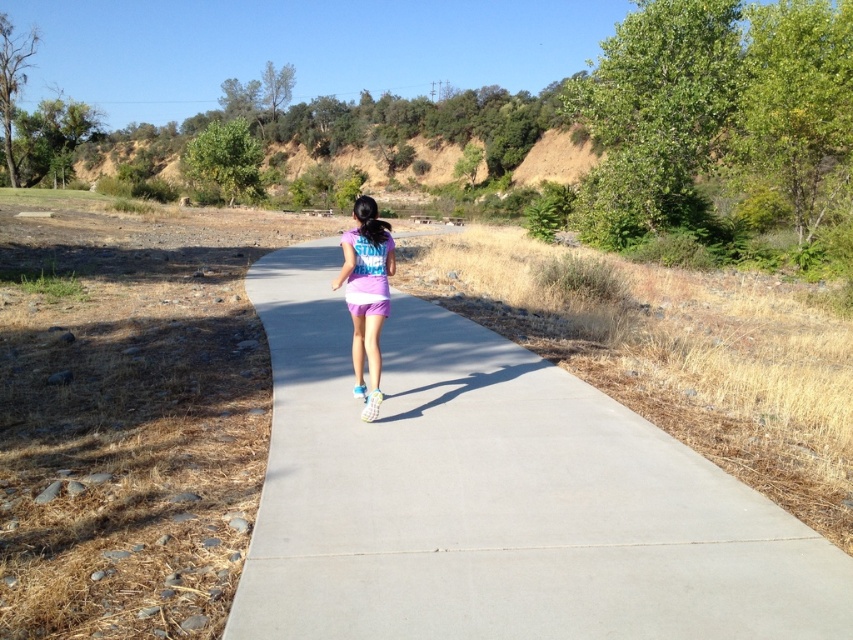
You are a photographer standing on the path and want to take a photo of the purple fabric shorts at center. Since the gray concrete pavement at center is below it, where should you position your camera relative to the path to capture the shorts in the shot?

Since the gray concrete pavement at center is below the purple fabric shorts at center, you should position your camera above the path to ensure the shorts are visible and not blocked by the pavement in the photo.

You are a photographer trying to capture the entire scene of the gray concrete pavement at center and the purple fabric shorts at center in one shot. Based on their sizes, which object should you focus on to ensure both are visible without zooming in or out?

The gray concrete pavement at center is larger in size than the purple fabric shorts at center, so focusing on the gray concrete pavement at center would allow both objects to be visible without needing to adjust the zoom.